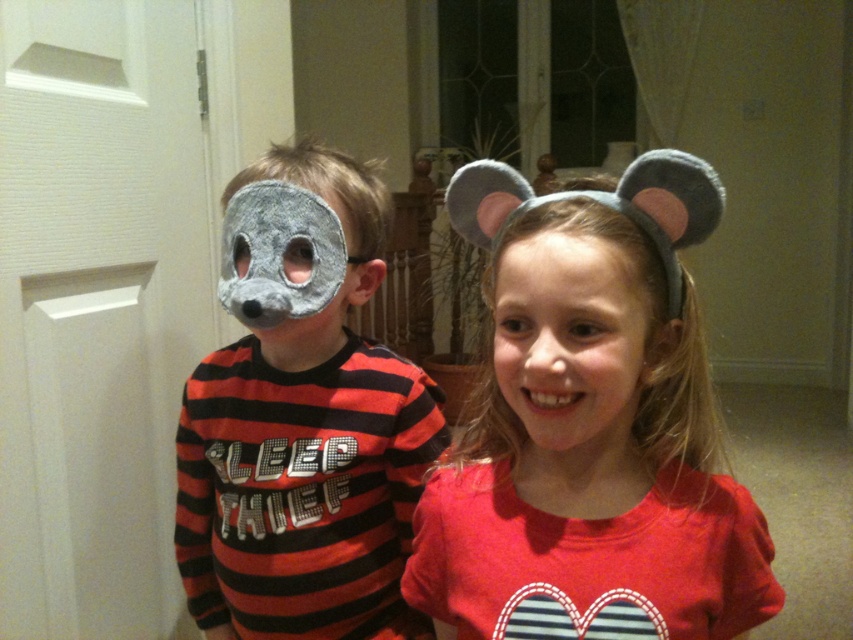
Measure the distance between felt gray mask at left and smooth skin face at center.

felt gray mask at left is 38.37 centimeters away from smooth skin face at center.

Does felt gray mask at left come in front of smooth skin face at center?

No, it is behind smooth skin face at center.

Is point (262, 432) positioned in front of point (622, 410)?

No, it is behind (622, 410).

Find the location of a particular element. felt gray mask at left is located at coordinates (305, 445).

Is matte gray headband with ears at center positioned before felt gray mask at left?

Yes, it is.

Is matte gray headband with ears at center positioned behind felt gray mask at left?

No, matte gray headband with ears at center is in front of felt gray mask at left.

Is point (549, 484) behind point (403, 358)?

No, (549, 484) is closer to viewer.

You are a GUI agent. You are given a task and a screenshot of the screen. Output one action in this format:
    pyautogui.click(x=<x>, y=<y>)
    Task: Click on the matte gray headband with ears at center
    This screenshot has width=853, height=640.
    Given the screenshot: What is the action you would take?
    pyautogui.click(x=590, y=426)

Locate an element on the screen. matte gray headband with ears at center is located at coordinates (590, 426).

How far apart are matte gray headband with ears at center and smooth skin face at center?

matte gray headband with ears at center and smooth skin face at center are 1.97 inches apart from each other.

Between point (631, 474) and point (555, 278), which one is positioned in front?

Point (555, 278)

This screenshot has width=853, height=640. I want to click on matte gray headband with ears at center, so coord(590,426).